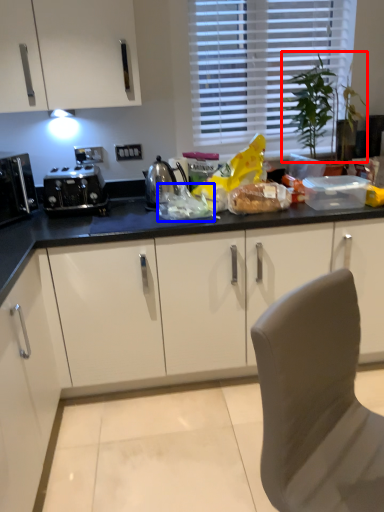
Question: Which of the following is the closest to the observer, plant (highlighted by a red box) or food (highlighted by a blue box)?

Choices:
 (A) plant
 (B) food

Answer: (B)